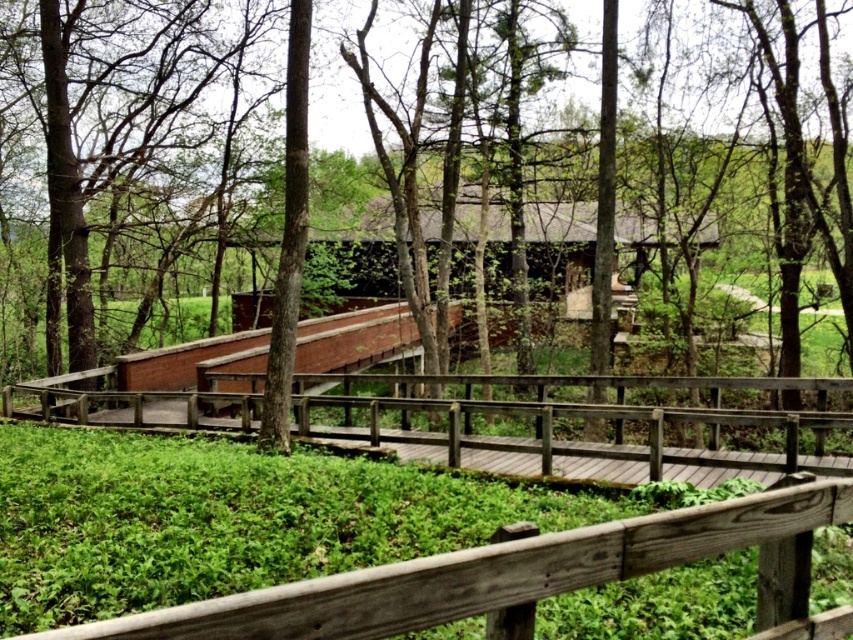
Describe the element at coordinates (582, 440) in the screenshot. Image resolution: width=853 pixels, height=640 pixels. I see `wooden bridge at center` at that location.

Is wooden bridge at center shorter than brown wood tree at center?

Correct, wooden bridge at center is not as tall as brown wood tree at center.

Who is more distant from viewer, (769, 387) or (782, 72)?

Point (782, 72)

You are a GUI agent. You are given a task and a screenshot of the screen. Output one action in this format:
    pyautogui.click(x=<x>, y=<y>)
    Task: Click on the wooden bridge at center
    This screenshot has width=853, height=640.
    Given the screenshot: What is the action you would take?
    pyautogui.click(x=582, y=440)